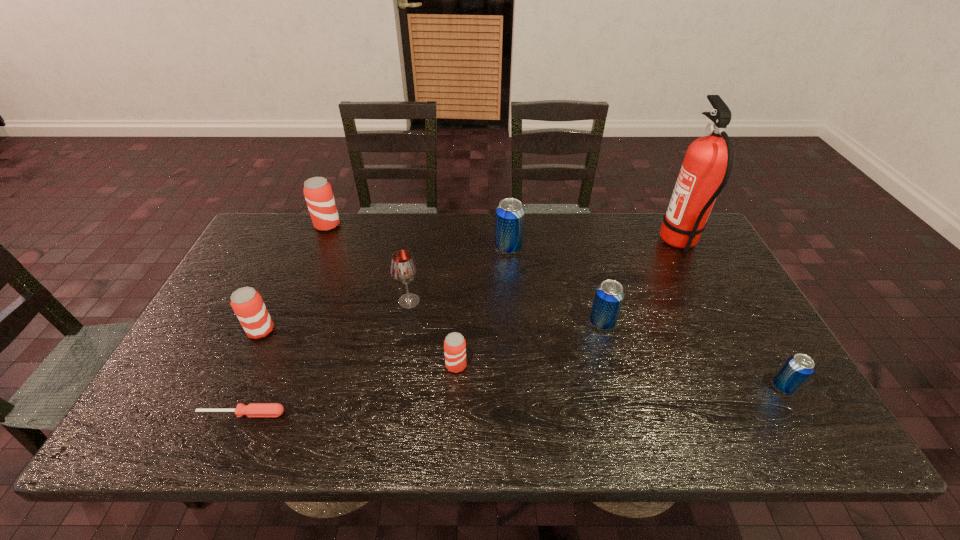
You are a GUI agent. You are given a task and a screenshot of the screen. Output one action in this format:
    pyautogui.click(x=<x>, y=<y>)
    Task: Click on the free location located on the front of the farthest beer can
    The width and height of the screenshot is (960, 540).
    Given the screenshot: What is the action you would take?
    (x=291, y=310)

Where is `free location located 0.150m on the right of the biggest blue beer can`? The width and height of the screenshot is (960, 540). free location located 0.150m on the right of the biggest blue beer can is located at coordinates (569, 248).

Locate an element on the screen. blank space located on the back of the sixth object from right to left is located at coordinates (417, 253).

Where is `vacant region located 0.190m on the back of the second nearest orange beer can`? vacant region located 0.190m on the back of the second nearest orange beer can is located at coordinates (288, 273).

I want to click on blank space located on the back of the third object from right to left, so click(578, 233).

The width and height of the screenshot is (960, 540). I want to click on vacant region located on the back of the nearest blue beer can, so click(713, 266).

Identify the location of free space located 0.380m on the left of the seventh farthest object. The width and height of the screenshot is (960, 540). (290, 366).

Where is `vacant space located 0.270m on the right of the screwdriver`? This screenshot has width=960, height=540. vacant space located 0.270m on the right of the screwdriver is located at coordinates (406, 414).

At what (x,y) coordinates should I click in order to perform the action: click on fire extinguisher at the far edge. Please return your answer as a coordinate pair (x, y). Looking at the image, I should click on (706, 168).

Find the location of a particular element. The height and width of the screenshot is (540, 960). object situated at the near edge is located at coordinates (253, 409).